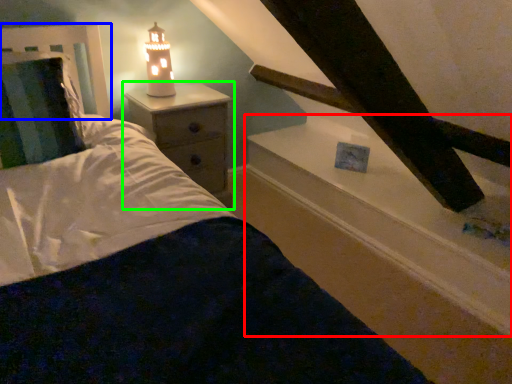
Question: Which object is the closest to the window sill (highlighted by a red box)? Choose among these: headboard (highlighted by a blue box) or nightstand (highlighted by a green box).

Choices:
 (A) headboard
 (B) nightstand

Answer: (B)